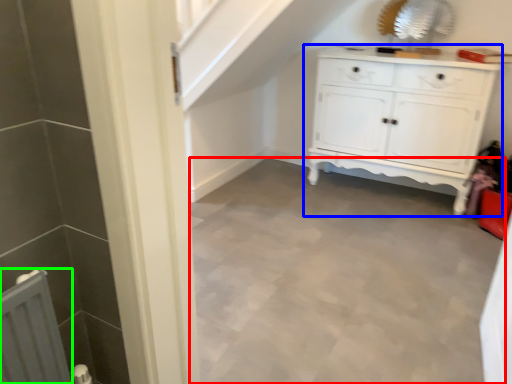
Question: Which is nearer to the plain (highlighted by a red box)? chest of drawers (highlighted by a blue box) or radiator (highlighted by a green box).

Choices:
 (A) chest of drawers
 (B) radiator

Answer: (A)